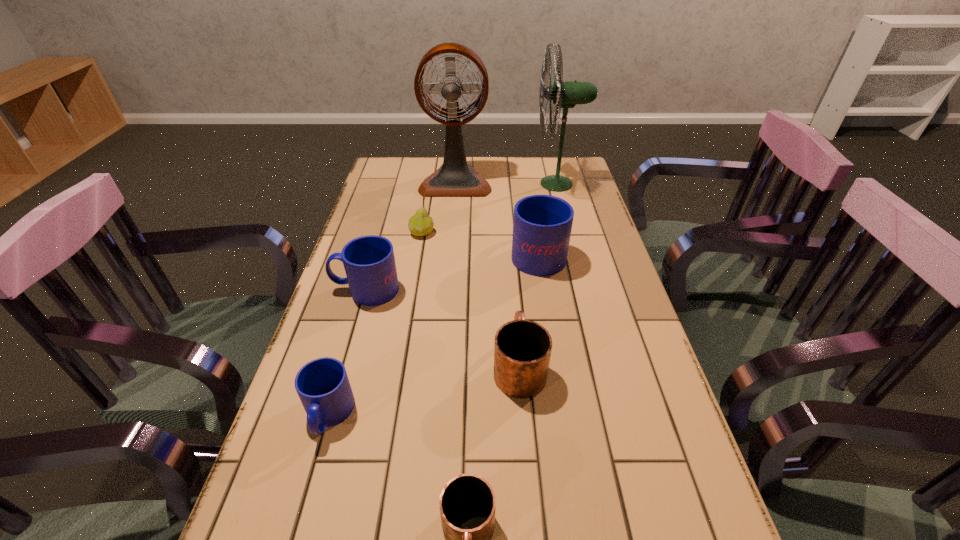
You are a GUI agent. You are given a task and a screenshot of the screen. Output one action in this format:
    pyautogui.click(x=<x>, y=<y>)
    Task: Click on the brown fan
    
    Given the screenshot: What is the action you would take?
    pyautogui.click(x=455, y=177)

You are a GUI agent. You are given a task and a screenshot of the screen. Output one action in this format:
    pyautogui.click(x=<x>, y=<y>)
    Task: Click on the green fan
    This screenshot has width=960, height=540.
    Given the screenshot: What is the action you would take?
    pyautogui.click(x=565, y=94)

I want to click on the tallest mug, so click(542, 224).

You are a GUI agent. You are given a task and a screenshot of the screen. Output one action in this format:
    pyautogui.click(x=<x>, y=<y>)
    Task: Click on the biggest blue mug
    Image resolution: width=960 pixels, height=540 pixels.
    Given the screenshot: What is the action you would take?
    pyautogui.click(x=542, y=224)

In order to click on the second biggest blue mug in this screenshot , I will do `click(369, 262)`.

Locate an element on the screen. The image size is (960, 540). green pear is located at coordinates (421, 224).

The width and height of the screenshot is (960, 540). Identify the location of the farther rust mug. (522, 349).

The image size is (960, 540). Find the location of `the right rust mug`. the right rust mug is located at coordinates (522, 349).

Find the location of a particular element. The width and height of the screenshot is (960, 540). the smallest blue mug is located at coordinates (323, 387).

Locate an element on the screen. vacant space located 0.050m on the front-facing side of the brown fan is located at coordinates (453, 205).